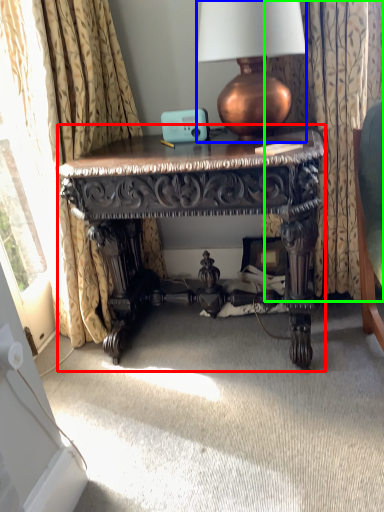
Question: Which object is positioned closest to desk (highlighted by a red box)? Select from lamp (highlighted by a blue box) and curtain (highlighted by a green box).

Choices:
 (A) lamp
 (B) curtain

Answer: (A)